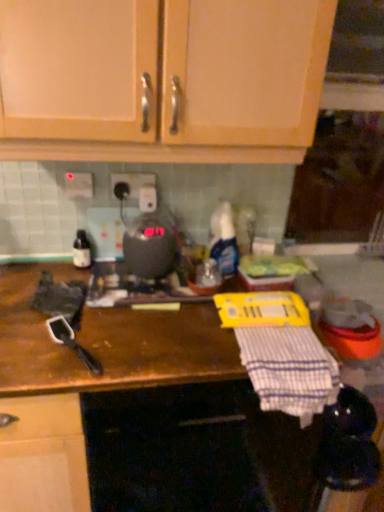
Locate an element on the screen. This screenshot has width=384, height=512. unoccupied region to the right of matte glass bottle at left, the 1th bottle viewed from the left is located at coordinates (114, 279).